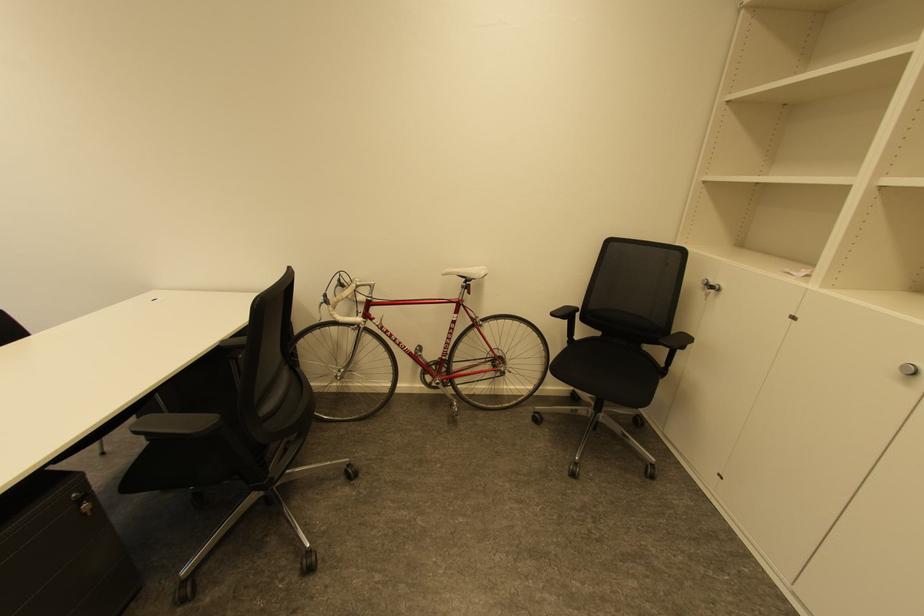
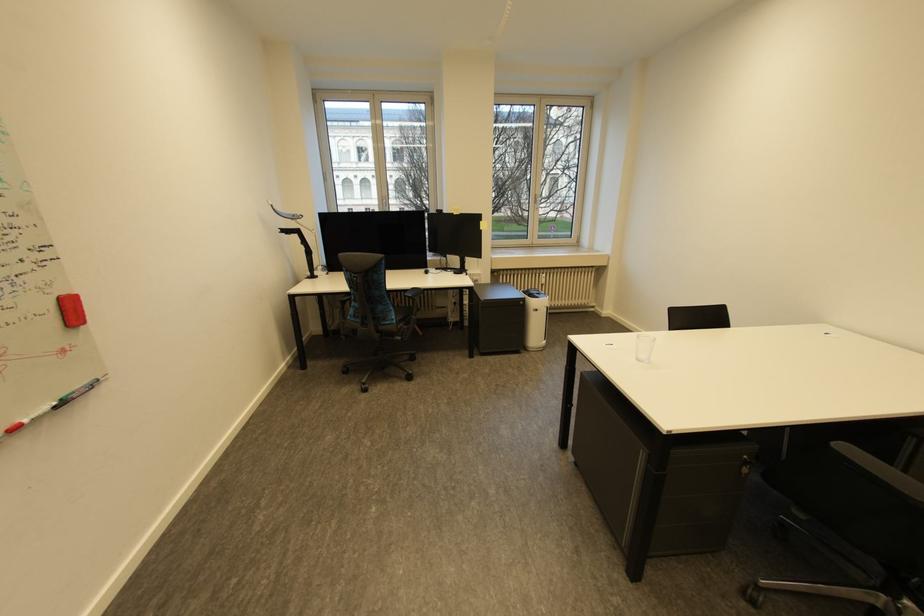
Question: The camera is either moving clockwise (left) or counter-clockwise (right) around the object. The first image is from the beginning of the video and the second image is from the end. Is the camera moving left or right when shooting the video?

Choices:
 (A) Left
 (B) Right

Answer: (B)